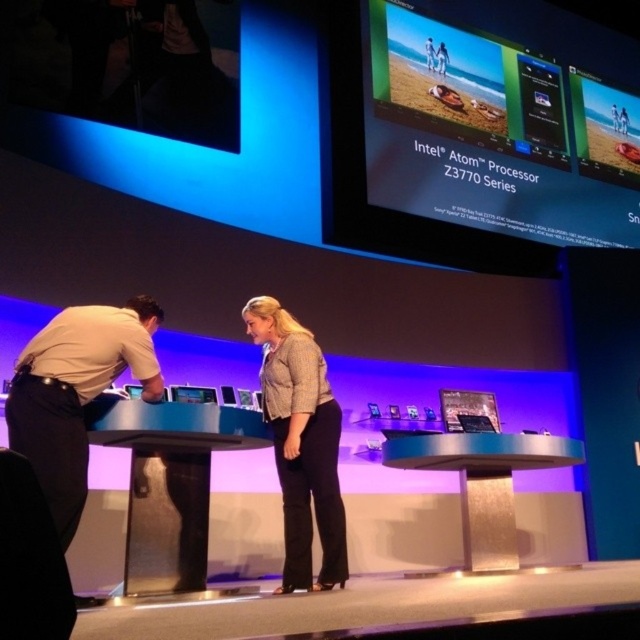
You are a stagehand setting up for a presentation. You need to place a 2.0 meter long extension cord from the light gray textured blazer at center to the matte black laptop at center. Will the cord be long enough to reach between them without needing to extend it further?

The light gray textured blazer at center and matte black laptop at center are 1.88 meters apart from each other. The 2.0 meter extension cord is longer than the distance between them, so it will be sufficient to reach without needing to extend it further.

You are directing a stage play and need to position an actor wearing a light beige shirt at left so that they are centered on the stage. Given their current position at coordinates point 0.616, 0.119, should you move them to the left or right to center them?

The light beige shirt at left is currently at coordinates point (76, 394). To center them on the stage, you would need to move them to the right since their current x coordinate is 0.616, which is to the right of the center point at 0.5. Moving them slightly to the left would bring them closer to the center.